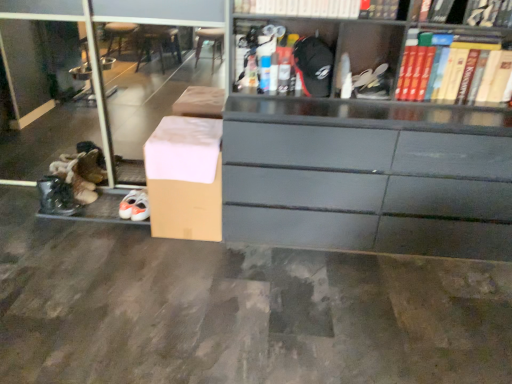
This screenshot has height=384, width=512. Describe the element at coordinates (372, 83) in the screenshot. I see `white matte shoe at upper center` at that location.

The image size is (512, 384). I want to click on white matte shoe at upper center, so click(x=372, y=83).

The height and width of the screenshot is (384, 512). Describe the element at coordinates (106, 121) in the screenshot. I see `brown cardboard box at lower left` at that location.

Measure the distance between brown cardboard box at lower left and camera.

brown cardboard box at lower left and camera are 2.75 meters apart.

What do you see at coordinates (468, 12) in the screenshot? I see `hardcover book at upper right, the first book from the right` at bounding box center [468, 12].

Describe the element at coordinates (301, 8) in the screenshot. I see `hardcover book at upper center, marked as the first book in a left-to-right arrangement` at that location.

You are a GUI agent. You are given a task and a screenshot of the screen. Output one action in this format:
    pyautogui.click(x=<x>, y=<y>)
    Task: Click on the white matte shoe at upper center
    This screenshot has height=384, width=512.
    Given the screenshot: What is the action you would take?
    pyautogui.click(x=372, y=83)

Consider the image. Considering the relative positions of hardcover book at upper right, marked as the third book in a left-to-right arrangement, and white matte shoe at upper center in the image provided, is hardcover book at upper right, marked as the third book in a left-to-right arrangement, behind white matte shoe at upper center?

No, it is not.

Is hardcover book at upper right, marked as the third book in a left-to-right arrangement, at the right side of white matte shoe at upper center?

Yes, hardcover book at upper right, marked as the third book in a left-to-right arrangement, is to the right of white matte shoe at upper center.

Is hardcover book at upper right, which is counted as the 2th book, starting from the right, spatially inside white matte shoe at upper center, or outside of it?

hardcover book at upper right, which is counted as the 2th book, starting from the right, lies outside white matte shoe at upper center.

From the picture: From a real-world perspective, is hardcover book at upper right, which is counted as the 2th book, starting from the right, positioned under white matte shoe at upper center based on gravity?

Actually, hardcover book at upper right, which is counted as the 2th book, starting from the right, is physically above white matte shoe at upper center in the real world.

From the image's perspective, is brown cardboard box at lower left positioned above or below hardcover book at upper right, the first book from the right?

brown cardboard box at lower left is below hardcover book at upper right, the first book from the right.

Consider the image. Which is behind, brown cardboard box at lower left or hardcover book at upper right, the first book from the right?

brown cardboard box at lower left.

Is brown cardboard box at lower left situated inside hardcover book at upper right, which is counted as the fourth book, starting from the left, or outside?

brown cardboard box at lower left is spatially situated outside hardcover book at upper right, which is counted as the fourth book, starting from the left.

Which of these two, brown cardboard box at lower left or hardcover book at upper right, which is counted as the fourth book, starting from the left, is smaller?

hardcover book at upper right, which is counted as the fourth book, starting from the left, is smaller.

From a real-world perspective, is brown cardboard box at lower left above or below brown cardboard box at lower left?

brown cardboard box at lower left is below brown cardboard box at lower left.

Is the position of brown cardboard box at lower left less distant than that of brown cardboard box at lower left?

Yes.

Between brown cardboard box at lower left and brown cardboard box at lower left, which one appears on the right side from the viewer's perspective?

brown cardboard box at lower left.

Is brown cardboard box at lower left a part of brown cardboard box at lower left?

No.

From the image's perspective, which book is the 2nd one above the white matte shoe at upper center? Please provide its 2D coordinates.

[(468, 12)]

Is point (508, 7) closer or farther from the camera than point (376, 69)?

Point (508, 7).

Is hardcover book at upper right, which is counted as the fourth book, starting from the left, positioned with its back to white matte shoe at upper center?

No, hardcover book at upper right, which is counted as the fourth book, starting from the left,'s orientation is not away from white matte shoe at upper center.

Would you consider hardcover book at upper right, the first book from the right, to be distant from white matte shoe at upper center?

hardcover book at upper right, the first book from the right, is actually quite close to white matte shoe at upper center.

Which is behind, white matte shoe at upper center or hardcover book at upper center, placed as the 2th book when sorted from left to right?

white matte shoe at upper center is further away from the camera.

Between white matte shoe at upper center and hardcover book at upper center, which is the 3th book from right to left, which one has smaller width?

white matte shoe at upper center is thinner.

Based on the photo, are white matte shoe at upper center and hardcover book at upper center, which is the 3th book from right to left, far apart?

No, white matte shoe at upper center is in close proximity to hardcover book at upper center, which is the 3th book from right to left.

From the image's perspective, is white matte shoe at upper center located above or below hardcover book at upper center, placed as the 2th book when sorted from left to right?

Based on their image positions, white matte shoe at upper center is located beneath hardcover book at upper center, placed as the 2th book when sorted from left to right.

Which of these two, brown cardboard box at lower left or white matte shoe at upper center, stands shorter?

With less height is white matte shoe at upper center.

How much distance is there between brown cardboard box at lower left and white matte shoe at upper center?

2.72 meters.

Do you think brown cardboard box at lower left is within white matte shoe at upper center, or outside of it?

brown cardboard box at lower left cannot be found inside white matte shoe at upper center.

How different are the orientations of brown cardboard box at lower left and white matte shoe at upper center in degrees?

There is a 0.246-degree angle between the facing directions of brown cardboard box at lower left and white matte shoe at upper center.

Is hardcover book at upper center, which is the 3th book from right to left, thinner than brown cardboard box at lower left?

Yes.

Find the location of a particular element. The height and width of the screenshot is (384, 512). cardboard box on the left of hardcover book at upper center, placed as the 2th book when sorted from left to right is located at coordinates (185, 178).

From the image's perspective, is hardcover book at upper center, which is the 3th book from right to left, located above or below brown cardboard box at lower left?

From the image's perspective, hardcover book at upper center, which is the 3th book from right to left, appears above brown cardboard box at lower left.

Based on their positions, is hardcover book at upper center, placed as the 2th book when sorted from left to right, located to the left or right of brown cardboard box at lower left?

Clearly, hardcover book at upper center, placed as the 2th book when sorted from left to right, is on the right of brown cardboard box at lower left in the image.

Where is `shoe on the left side of hardcover book at upper right, which is counted as the 2th book, starting from the right`? This screenshot has height=384, width=512. shoe on the left side of hardcover book at upper right, which is counted as the 2th book, starting from the right is located at coordinates (372, 83).

Where is `shelf behind the hardcover book at upper right, which is counted as the fourth book, starting from the left`? This screenshot has height=384, width=512. shelf behind the hardcover book at upper right, which is counted as the fourth book, starting from the left is located at coordinates (106, 121).

Looking at the image, which one is located closer to hardcover book at upper center, marked as the first book in a left-to-right arrangement, white matte shoe at upper center or brown cardboard box at lower left?

white matte shoe at upper center is positioned closer to the anchor hardcover book at upper center, marked as the first book in a left-to-right arrangement.

Estimate the real-world distances between objects in this image. Which object is further from hardcover book at upper right, which is counted as the fourth book, starting from the left, brown cardboard box at lower left or hardcover book at upper center, which is the fourth book from right to left?

brown cardboard box at lower left lies further to hardcover book at upper right, which is counted as the fourth book, starting from the left, than the other object.

Which object lies nearer to the anchor point brown cardboard box at lower left, hardcover book at upper right, which is counted as the fourth book, starting from the left, or hardcover book at upper center, which is the 3th book from right to left?

hardcover book at upper center, which is the 3th book from right to left, is positioned closer to the anchor brown cardboard box at lower left.

Estimate the real-world distances between objects in this image. Which object is further from hardcover book at upper center, placed as the 2th book when sorted from left to right, brown cardboard box at lower left or white matte shoe at upper center?

Based on the image, brown cardboard box at lower left appears to be further to hardcover book at upper center, placed as the 2th book when sorted from left to right.

Which object lies further to the anchor point brown cardboard box at lower left, hardcover book at upper right, which is counted as the 2th book, starting from the right, or hardcover book at upper center, marked as the first book in a left-to-right arrangement?

Among the two, hardcover book at upper right, which is counted as the 2th book, starting from the right, is located further to brown cardboard box at lower left.

Based on their spatial positions, is hardcover book at upper right, which is counted as the 2th book, starting from the right, or white matte shoe at upper center closer to brown cardboard box at lower left?

Based on the image, white matte shoe at upper center appears to be nearer to brown cardboard box at lower left.

Which object lies further to the anchor point hardcover book at upper right, which is counted as the 2th book, starting from the right, hardcover book at upper right, the first book from the right, or hardcover book at upper center, which is the fourth book from right to left?

hardcover book at upper center, which is the fourth book from right to left, lies further to hardcover book at upper right, which is counted as the 2th book, starting from the right, than the other object.

From the image, which object appears to be farther from hardcover book at upper right, the first book from the right, brown cardboard box at lower left or hardcover book at upper center, placed as the 2th book when sorted from left to right?

The object further to hardcover book at upper right, the first book from the right, is brown cardboard box at lower left.

The height and width of the screenshot is (384, 512). Find the location of `book located between brown cardboard box at lower left and white matte shoe at upper center in the left-right direction`. book located between brown cardboard box at lower left and white matte shoe at upper center in the left-right direction is located at coordinates (301, 8).

This screenshot has width=512, height=384. Find the location of `shoe located between brown cardboard box at lower left and hardcover book at upper center, which is the 3th book from right to left, in the left-right direction`. shoe located between brown cardboard box at lower left and hardcover book at upper center, which is the 3th book from right to left, in the left-right direction is located at coordinates [372, 83].

Where is `shoe between hardcover book at upper center, marked as the first book in a left-to-right arrangement, and hardcover book at upper right, the first book from the right`? This screenshot has width=512, height=384. shoe between hardcover book at upper center, marked as the first book in a left-to-right arrangement, and hardcover book at upper right, the first book from the right is located at coordinates (372, 83).

I want to click on shoe between brown cardboard box at lower left and hardcover book at upper center, which is the 3th book from right to left, from left to right, so click(x=372, y=83).